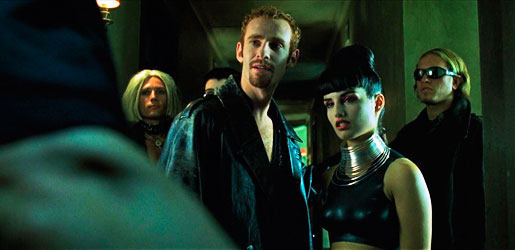
Identify the location of overhead light. This screenshot has width=515, height=250. (108, 1).